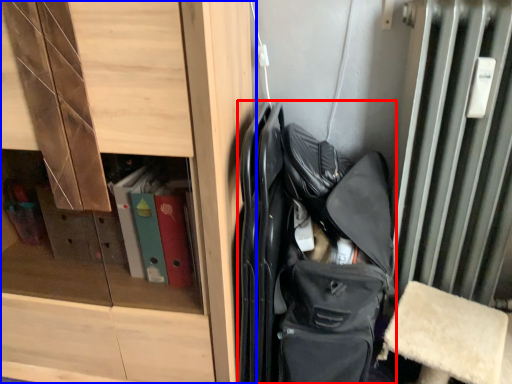
Question: Among these objects, which one is nearest to the camera, bag (highlighted by a red box) or cabinetry (highlighted by a blue box)?

Choices:
 (A) bag
 (B) cabinetry

Answer: (B)